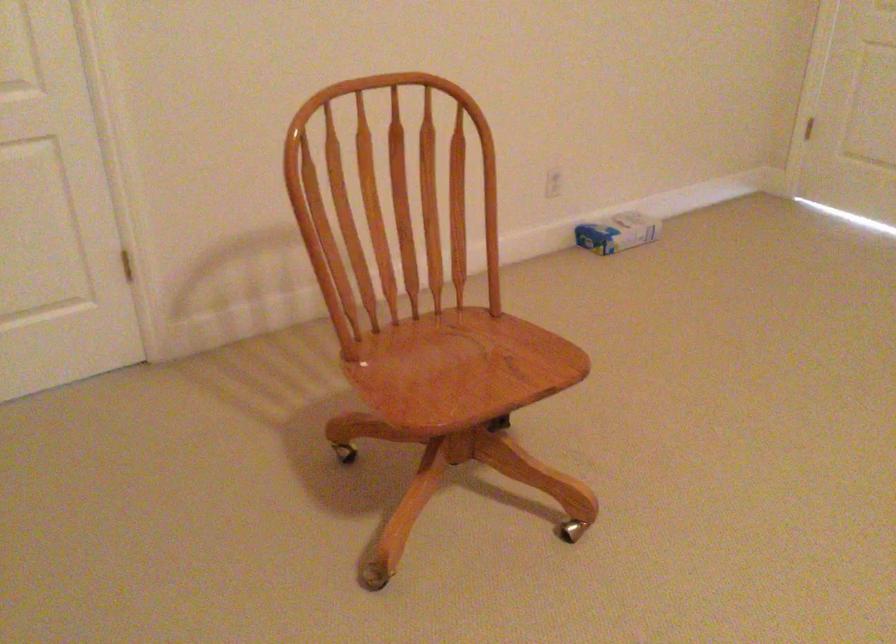
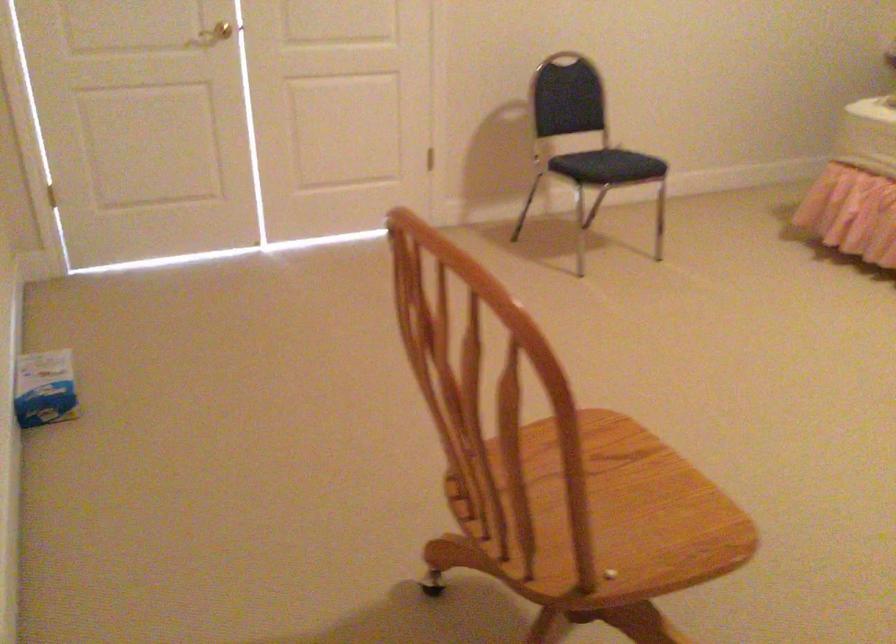
Question: I am providing you with two images of the same scene from different viewpoints. After the viewpoint changes to image2, which objects are now occluded?

Choices:
 (A) brass door handle
 (B) wooden chair sitting surface
 (C) chair sitting surface
 (D) padded leg roller

Answer: (C)